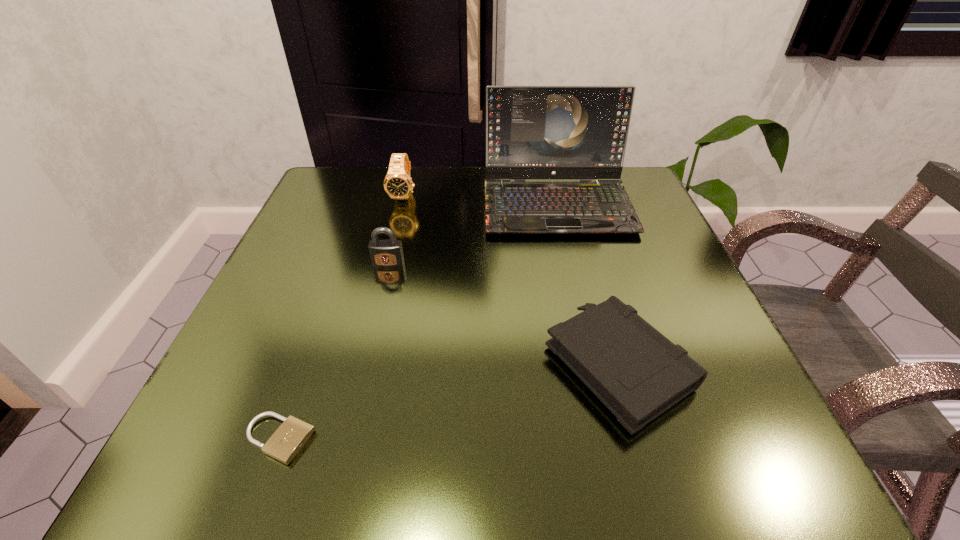
The image size is (960, 540). Identify the location of laptop computer. (532, 132).

This screenshot has height=540, width=960. I want to click on the second tallest object, so click(398, 184).

Find the location of a particular element. the taller padlock is located at coordinates (385, 253).

Locate an element on the screen. The width and height of the screenshot is (960, 540). the third farthest object is located at coordinates (385, 253).

You are a GUI agent. You are given a task and a screenshot of the screen. Output one action in this format:
    pyautogui.click(x=<x>, y=<y>)
    Task: Click on the second shortest object
    
    Given the screenshot: What is the action you would take?
    pyautogui.click(x=636, y=372)

The height and width of the screenshot is (540, 960). I want to click on the shorter padlock, so click(x=286, y=442).

You are a GUI agent. You are given a task and a screenshot of the screen. Output one action in this format:
    pyautogui.click(x=<x>, y=<y>)
    Task: Click on the leftmost object
    The image size is (960, 540).
    Given the screenshot: What is the action you would take?
    pyautogui.click(x=286, y=442)

Where is `free space located 0.090m on the screen of the laptop computer`? The image size is (960, 540). free space located 0.090m on the screen of the laptop computer is located at coordinates (571, 267).

Find the location of `free space located 0.390m on the face of the watch`. free space located 0.390m on the face of the watch is located at coordinates (369, 343).

Find the location of a particular element. free space located on the front of the third tallest object near the keyhole is located at coordinates (348, 432).